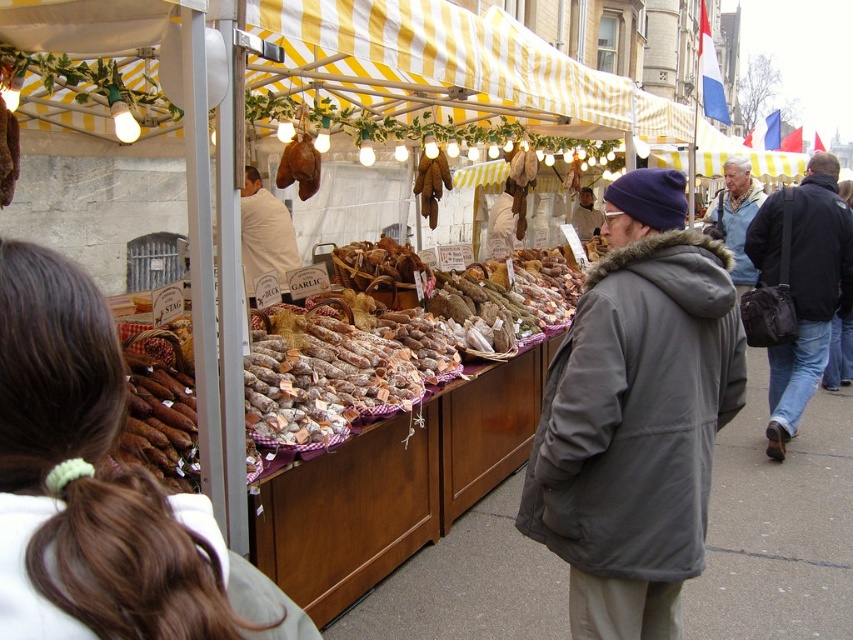
Question: Considering the real-world distances, which object is closest to the light blue knit hat at upper right?

Choices:
 (A) brown leather gloves at center
 (B) black leather bag at right
 (C) brown leather bag at center

Answer: (B)

Question: Can you confirm if gray wool coat at center is positioned below light blue knit hat at upper right?

Choices:
 (A) no
 (B) yes

Answer: (B)

Question: Does light brown hair at center appear on the right side of brown crumbly bread at center?

Choices:
 (A) no
 (B) yes

Answer: (A)

Question: Can you confirm if brown leather gloves at center is positioned above matte gray coat at center?

Choices:
 (A) no
 (B) yes

Answer: (A)

Question: Estimate the real-world distances between objects in this image. Which object is farther from the brown leather gloves at center?

Choices:
 (A) black leather bag at right
 (B) gray wool coat at center
 (C) white clothed man at center
 (D) brown leather bag at center

Answer: (B)

Question: Which point is closer to the camera taking this photo?

Choices:
 (A) (714, 362)
 (B) (416, 371)
 (C) (300, 150)
 (D) (421, 170)

Answer: (A)